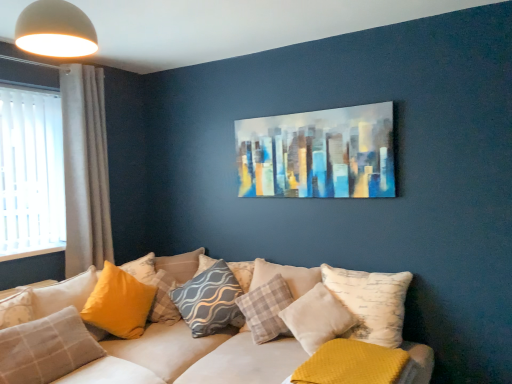
Describe the element at coordinates (46, 348) in the screenshot. The width and height of the screenshot is (512, 384). I see `yellow fabric pillow at lower left, which is the 8th pillow in right-to-left order` at that location.

What is the approximate width of yellow fabric pillow at lower left, which is counted as the 9th pillow, starting from the right?

yellow fabric pillow at lower left, which is counted as the 9th pillow, starting from the right, is 9.67 inches in width.

What is the approximate width of yellow fabric pillow at center, the sixth pillow positioned from the right?

yellow fabric pillow at center, the sixth pillow positioned from the right, is 11.05 inches wide.

Describe the element at coordinates (210, 300) in the screenshot. I see `gray wavy-patterned pillow at center, which is the 5th pillow from left to right` at that location.

Where is `gray fabric curtain at left`? The width and height of the screenshot is (512, 384). gray fabric curtain at left is located at coordinates (85, 169).

Is plaid fabric pillow at center, which ranks as the seventh pillow in left-to-right order, oriented towards matte yellow pillow at lower left, marked as the third pillow in a left-to-right arrangement?

No, plaid fabric pillow at center, which ranks as the seventh pillow in left-to-right order, is not facing towards matte yellow pillow at lower left, marked as the third pillow in a left-to-right arrangement.

From the image's perspective, is plaid fabric pillow at center, which ranks as the seventh pillow in left-to-right order, on top of matte yellow pillow at lower left, positioned as the seventh pillow in right-to-left order?

Actually, plaid fabric pillow at center, which ranks as the seventh pillow in left-to-right order, appears below matte yellow pillow at lower left, positioned as the seventh pillow in right-to-left order, in the image.

Between plaid fabric pillow at center, which ranks as the 3th pillow in right-to-left order, and matte yellow pillow at lower left, marked as the third pillow in a left-to-right arrangement, which one has less height?

Standing shorter between the two is matte yellow pillow at lower left, marked as the third pillow in a left-to-right arrangement.

Can you confirm if plaid fabric pillow at center, which ranks as the seventh pillow in left-to-right order, is positioned to the left of matte yellow pillow at lower left, positioned as the seventh pillow in right-to-left order?

In fact, plaid fabric pillow at center, which ranks as the seventh pillow in left-to-right order, is to the right of matte yellow pillow at lower left, positioned as the seventh pillow in right-to-left order.

From the image's perspective, which is above, yellow fabric pillow at center, placed as the fourth pillow when sorted from left to right, or white matte dome at upper left?

white matte dome at upper left.

From a real-world perspective, count 5th pillows downward from the white matte dome at upper left and point to it. Please provide its 2D coordinates.

[(163, 299)]

What's the angular difference between yellow fabric pillow at center, placed as the fourth pillow when sorted from left to right, and white matte dome at upper left's facing directions?

The angular difference between yellow fabric pillow at center, placed as the fourth pillow when sorted from left to right, and white matte dome at upper left is 33.9 degrees.

From the gray textured pillow at center, the 4th pillow from the right, count 1st pillow to the right and point to it. Please provide its 2D coordinates.

[(266, 309)]

In the scene shown: Between plaid fabric pillow at center, which ranks as the seventh pillow in left-to-right order, and gray textured pillow at center, the 4th pillow from the right, which one has larger size?

plaid fabric pillow at center, which ranks as the seventh pillow in left-to-right order, is bigger.

Relative to gray textured pillow at center, the 4th pillow from the right, is plaid fabric pillow at center, which ranks as the 3th pillow in right-to-left order, in front or behind?

plaid fabric pillow at center, which ranks as the 3th pillow in right-to-left order, is in front of gray textured pillow at center, the 4th pillow from the right.

Considering the relative positions of white matte dome at upper left and gray textured pillow at center, the sixth pillow in the left-to-right sequence, in the image provided, is white matte dome at upper left to the left of gray textured pillow at center, the sixth pillow in the left-to-right sequence, from the viewer's perspective?

Yes, white matte dome at upper left is to the left of gray textured pillow at center, the sixth pillow in the left-to-right sequence.

From a real-world perspective, relative to gray textured pillow at center, the 4th pillow from the right, is white matte dome at upper left vertically above or below?

Clearly, from a real-world perspective, white matte dome at upper left is above gray textured pillow at center, the 4th pillow from the right.

Considering the sizes of white matte dome at upper left and gray textured pillow at center, the 4th pillow from the right, in the image, is white matte dome at upper left bigger or smaller than gray textured pillow at center, the 4th pillow from the right,?

In the image, white matte dome at upper left appears to be smaller than gray textured pillow at center, the 4th pillow from the right.

Is point (46, 47) positioned before point (208, 259)?

Yes, it is.

Is gray textured pillow at center, the 4th pillow from the right, not inside white matte dome at upper left?

Absolutely, gray textured pillow at center, the 4th pillow from the right, is external to white matte dome at upper left.

Between gray textured pillow at center, the 4th pillow from the right, and white matte dome at upper left, which one has smaller size?

With smaller size is white matte dome at upper left.

Who is taller, gray textured pillow at center, the 4th pillow from the right, or white matte dome at upper left?

With more height is gray textured pillow at center, the 4th pillow from the right.

Who is shorter, velvet white couch at lower center or gray fabric curtain at left?

velvet white couch at lower center.

Are velvet white couch at lower center and gray fabric curtain at left far apart?

Yes, velvet white couch at lower center is far from gray fabric curtain at left.

Which is further, (98,363) or (81,181)?

The point (81,181) is farther.

Would you say velvet white couch at lower center is inside or outside gray fabric curtain at left?

velvet white couch at lower center lies outside gray fabric curtain at left.

From the image's perspective, does white textured pillow at center, the eighth pillow from the left, appear lower than yellow fabric pillow at lower left, which is counted as the 9th pillow, starting from the right?

Correct, white textured pillow at center, the eighth pillow from the left, appears lower than yellow fabric pillow at lower left, which is counted as the 9th pillow, starting from the right, in the image.

Is white textured pillow at center, the 2th pillow positioned from the right, in front of or behind yellow fabric pillow at lower left, marked as the first pillow in a left-to-right arrangement, in the image?

In the image, white textured pillow at center, the 2th pillow positioned from the right, appears in front of yellow fabric pillow at lower left, marked as the first pillow in a left-to-right arrangement.

Is white textured pillow at center, the 2th pillow positioned from the right, in contact with yellow fabric pillow at lower left, marked as the first pillow in a left-to-right arrangement?

No, white textured pillow at center, the 2th pillow positioned from the right, is not beside yellow fabric pillow at lower left, marked as the first pillow in a left-to-right arrangement.

Considering the relative sizes of white textured pillow at center, the 2th pillow positioned from the right, and yellow fabric pillow at lower left, which is counted as the 9th pillow, starting from the right, in the image provided, is white textured pillow at center, the 2th pillow positioned from the right, smaller than yellow fabric pillow at lower left, which is counted as the 9th pillow, starting from the right,?

No.

This screenshot has width=512, height=384. Identify the location of the 4th pillow above when counting from the plaid fabric pillow at center, which ranks as the seventh pillow in left-to-right order (from the image's perspective). (141, 268).

Where is `light fixture above the yellow fabric pillow at center, the sixth pillow positioned from the right (from a real-world perspective)`? The image size is (512, 384). light fixture above the yellow fabric pillow at center, the sixth pillow positioned from the right (from a real-world perspective) is located at coordinates (55, 30).

Estimate the real-world distances between objects in this image. Which object is closer to velvet white couch at lower center, mustard yellow textured pillow at lower right, which ranks as the 1th pillow in right-to-left order, or gray fabric curtain at left?

mustard yellow textured pillow at lower right, which ranks as the 1th pillow in right-to-left order, is positioned closer to the anchor velvet white couch at lower center.

Considering their positions, is yellow fabric pillow at lower left, which is the 8th pillow in right-to-left order, positioned closer to mustard yellow textured pillow at lower right, which ranks as the 1th pillow in right-to-left order, than yellow fabric pillow at lower left, marked as the first pillow in a left-to-right arrangement?

yellow fabric pillow at lower left, which is the 8th pillow in right-to-left order.

Looking at the image, which one is located closer to mustard yellow textured pillow at lower right, which ranks as the 1th pillow in right-to-left order, abstract painting at upper center or gray fabric curtain at left?

abstract painting at upper center is closer to mustard yellow textured pillow at lower right, which ranks as the 1th pillow in right-to-left order.

When comparing their distances from plaid fabric pillow at center, which ranks as the seventh pillow in left-to-right order, does yellow fabric pillow at lower left, which is the 8th pillow in right-to-left order, or abstract painting at upper center seem further?

The object further to plaid fabric pillow at center, which ranks as the seventh pillow in left-to-right order, is yellow fabric pillow at lower left, which is the 8th pillow in right-to-left order.

Estimate the real-world distances between objects in this image. Which object is further from velvet white couch at lower center, plaid fabric pillow at center, which ranks as the 3th pillow in right-to-left order, or gray wavy-patterned pillow at center, arranged as the 5th pillow when viewed from the right?

plaid fabric pillow at center, which ranks as the 3th pillow in right-to-left order, is positioned further to the anchor velvet white couch at lower center.

From the image, which object appears to be nearer to yellow fabric pillow at lower left, which is counted as the 9th pillow, starting from the right, mustard yellow textured pillow at lower right, which is the 9th pillow from left to right, or abstract painting at upper center?

abstract painting at upper center is positioned closer to the anchor yellow fabric pillow at lower left, which is counted as the 9th pillow, starting from the right.

Considering their positions, is mustard yellow textured pillow at lower right, which ranks as the 1th pillow in right-to-left order, positioned closer to velvet white couch at lower center than yellow fabric pillow at lower left, the second pillow positioned from the left?

yellow fabric pillow at lower left, the second pillow positioned from the left, is closer to velvet white couch at lower center.

Estimate the real-world distances between objects in this image. Which object is closer to white textured pillow at center, the 2th pillow positioned from the right, gray wavy-patterned pillow at center, arranged as the 5th pillow when viewed from the right, or white matte dome at upper left?

gray wavy-patterned pillow at center, arranged as the 5th pillow when viewed from the right, is positioned closer to the anchor white textured pillow at center, the 2th pillow positioned from the right.

Find the location of a particular element. picture frame between velvet white couch at lower center and matte yellow pillow at lower left, positioned as the seventh pillow in right-to-left order, along the z-axis is located at coordinates (318, 153).

Find the location of `curtain situated between yellow fabric pillow at lower left, which is counted as the 9th pillow, starting from the right, and gray textured pillow at center, the sixth pillow in the left-to-right sequence, from left to right`. curtain situated between yellow fabric pillow at lower left, which is counted as the 9th pillow, starting from the right, and gray textured pillow at center, the sixth pillow in the left-to-right sequence, from left to right is located at coordinates (85, 169).

Identify the location of studio couch between yellow fabric pillow at lower left, the second pillow positioned from the left, and white textured pillow at center, the eighth pillow from the left, from left to right. (190, 358).

At what (x,y) coordinates should I click in order to perform the action: click on picture frame between white matte dome at upper left and gray wavy-patterned pillow at center, which is the 5th pillow from left to right, in the vertical direction. Please return your answer as a coordinate pair (x, y). The width and height of the screenshot is (512, 384). Looking at the image, I should click on (318, 153).